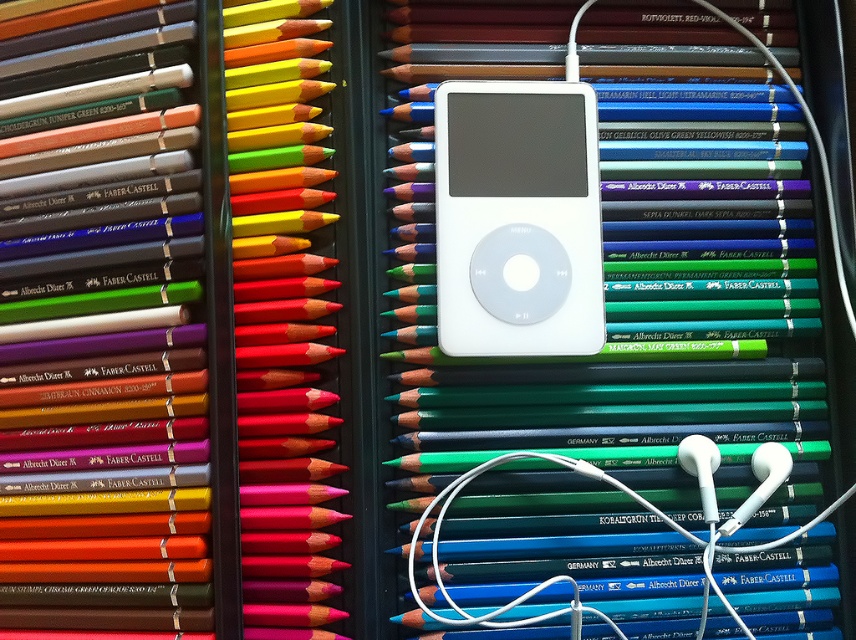
Question: Among these points, which one is farthest from the camera?

Choices:
 (A) (230, 144)
 (B) (568, 164)
 (C) (742, 538)

Answer: (A)

Question: Which point is closer to the camera?

Choices:
 (A) green matte pencil at center
 (B) white matte ipod at center

Answer: (A)

Question: Can you confirm if green matte pencil at center is positioned below matte red pencil at center?

Choices:
 (A) no
 (B) yes

Answer: (B)

Question: Observing the image, what is the correct spatial positioning of matte red pencil at center in reference to white matte ipod at center?

Choices:
 (A) below
 (B) above

Answer: (A)

Question: Which of these objects is positioned farthest from the matte red pencil at center?

Choices:
 (A) green matte pencil at center
 (B) white matte ipod at center

Answer: (A)

Question: Is matte red pencil at center thinner than white matte ipod at center?

Choices:
 (A) yes
 (B) no

Answer: (A)